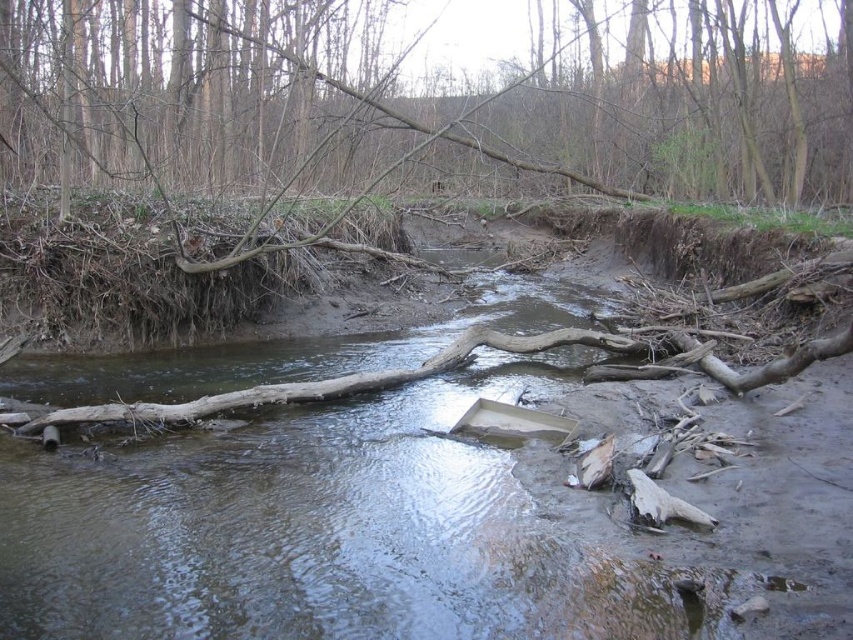
Can you confirm if brown muddy river at center is taller than brown wood log at center?

No.

Which is behind, point (10, 492) or point (280, 76)?

Positioned behind is point (280, 76).

Identify the location of brown muddy river at center. (328, 529).